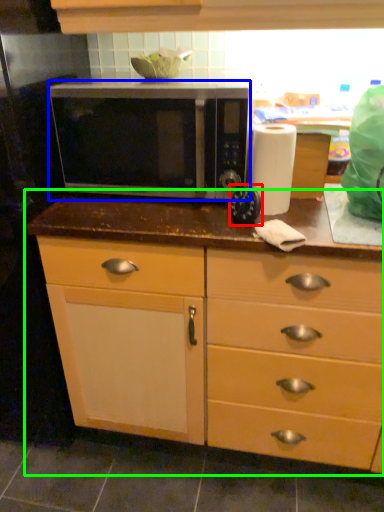
Question: Which object is positioned closest to appliance (highlighted by a red box)? Select from microwave oven (highlighted by a blue box) and cabinetry (highlighted by a green box).

Choices:
 (A) microwave oven
 (B) cabinetry

Answer: (A)